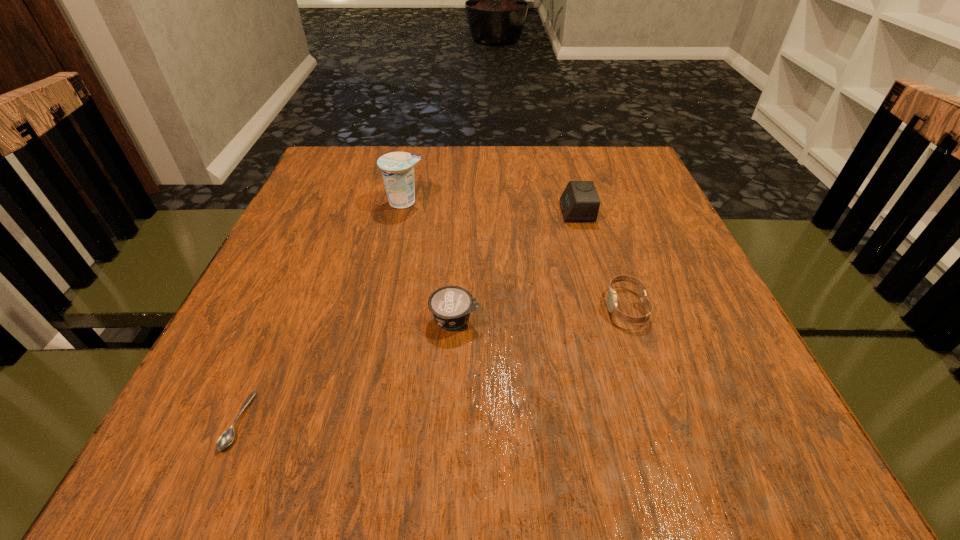
Where is `vacant space in between the leftmost object and the nearer yogurt`? This screenshot has height=540, width=960. vacant space in between the leftmost object and the nearer yogurt is located at coordinates (347, 370).

In order to click on blank region between the nearer yogurt and the fourth shortest object in this screenshot , I will do `click(516, 265)`.

Find the location of a particular element. vacant region between the alarm clock and the nearer yogurt is located at coordinates (516, 265).

Locate an element on the screen. free space between the farther yogurt and the second tallest object is located at coordinates (491, 207).

Locate an element on the screen. free space between the tallest object and the third object from left to right is located at coordinates (430, 260).

The width and height of the screenshot is (960, 540). I want to click on vacant space that's between the alarm clock and the tallest object, so click(491, 207).

Select which object is the closest to the soupspoon. Please provide its 2D coordinates. Your answer should be formatted as a tuple, i.e. [(x, y)], where the tuple contains the x and y coordinates of a point satisfying the conditions above.

[(451, 306)]

Select which object is the third closest to the tallest object. Please provide its 2D coordinates. Your answer should be formatted as a tuple, i.e. [(x, y)], where the tuple contains the x and y coordinates of a point satisfying the conditions above.

[(611, 296)]

This screenshot has width=960, height=540. I want to click on vacant space that satisfies the following two spatial constraints: 1. on the back side of the soupspoon; 2. on the left side of the left yogurt, so click(333, 202).

Locate an element on the screen. Image resolution: width=960 pixels, height=540 pixels. blank area in the image that satisfies the following two spatial constraints: 1. on the face of the watch; 2. on the front side of the shortest object is located at coordinates (664, 421).